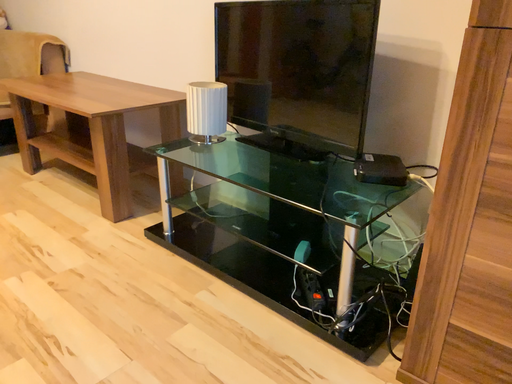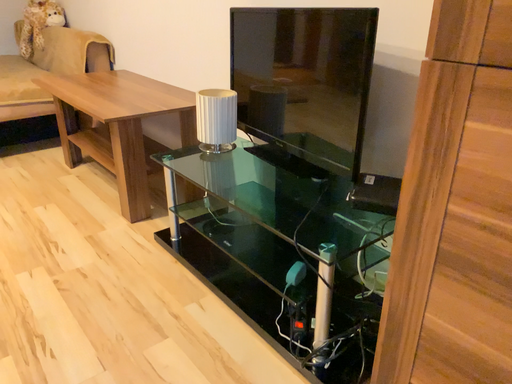
Question: How did the camera likely rotate when shooting the video?

Choices:
 (A) rotated right
 (B) rotated left

Answer: (B)